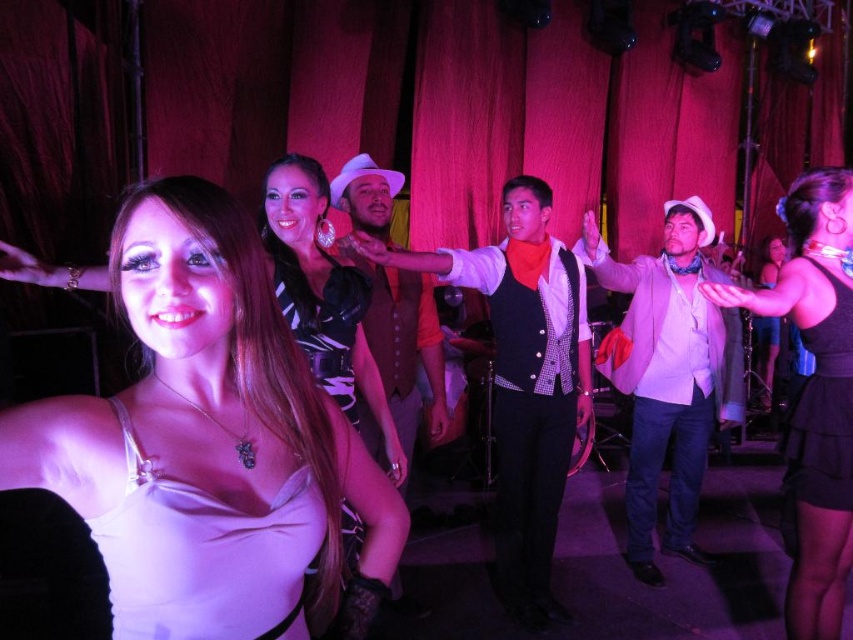
Does point (532, 566) come closer to viewer compared to point (173, 588)?

No.

Can you confirm if shiny silver vest at center is positioned to the left of white satin dress at lower left?

Incorrect, shiny silver vest at center is not on the left side of white satin dress at lower left.

Which is behind, point (578, 292) or point (117, 611)?

The point (578, 292) is behind.

Where is `shiny silver vest at center`? The width and height of the screenshot is (853, 640). shiny silver vest at center is located at coordinates (523, 378).

Who is shorter, black satin dress at right or satin black dress at center?

With less height is satin black dress at center.

Does black satin dress at right have a greater height compared to satin black dress at center?

Indeed, black satin dress at right has a greater height compared to satin black dress at center.

Is point (815, 474) positioned in front of point (352, 291)?

No, (815, 474) is behind (352, 291).

The height and width of the screenshot is (640, 853). I want to click on black satin dress at right, so click(x=822, y=412).

Between matte white dress at center and black satin dress at right, which one has less height?

matte white dress at center is shorter.

Who is more forward, (372, 520) or (837, 387)?

Point (372, 520)

Locate an element on the screen. This screenshot has height=640, width=853. matte white dress at center is located at coordinates (242, 378).